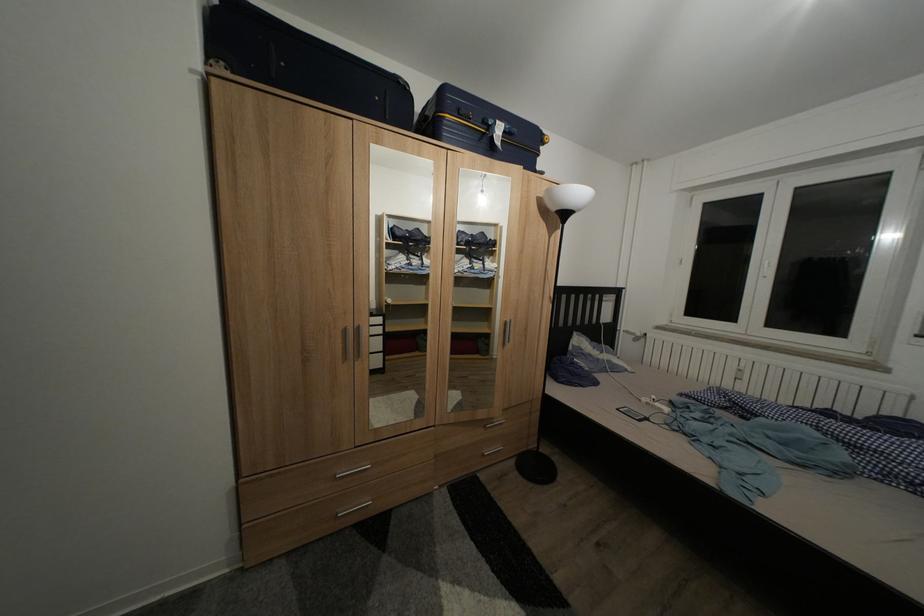
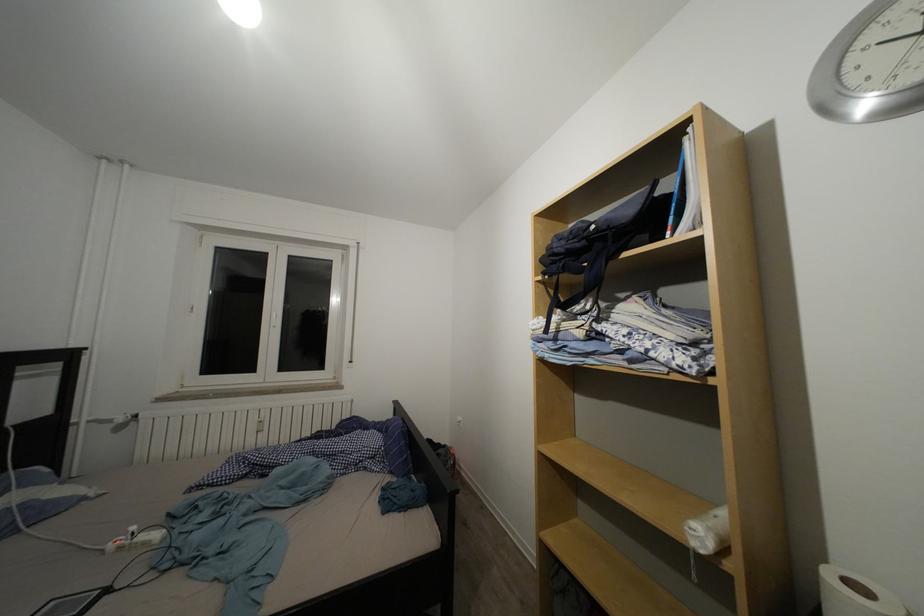
Where in the second image is the point corresponding to pixel 661 403 from the first image?

(140, 533)